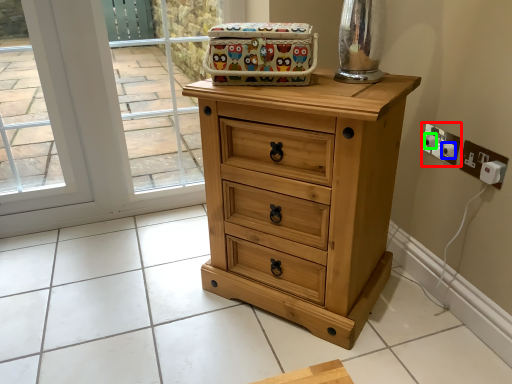
Question: Based on their relative distances, which object is nearer to electric outlet (highlighted by a red box)? Choose from knob (highlighted by a blue box) and knob (highlighted by a green box).

Choices:
 (A) knob
 (B) knob

Answer: (B)